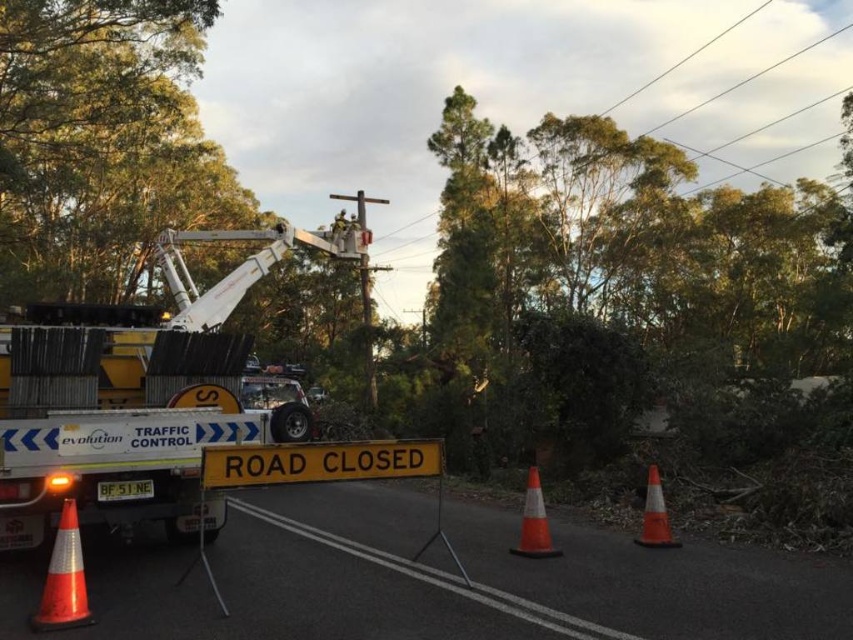
You are a pedestrian approaching the road closure area. You see the orange reflective cone at lower left and the orange reflective cone at center. Which cone is closer to you as you approach?

The orange reflective cone at lower left is closer to you because it is positioned in front of the orange reflective cone at center.

You are a delivery driver who needs to navigate around the white metallic tow truck at center and the orange reflective cone at lower left. The road is narrow here. Can your 3.5 meter long delivery van safely pass between them without hitting either?

The white metallic tow truck at center is 4.16 meters away from the orange reflective cone at lower left. Since your delivery van is 3.5 meters long, which is shorter than the distance between them, it should be able to safely pass through the gap without hitting either object.

You are a pedestrian trying to cross the road and see the white metallic tow truck at center and the orange reflective cone at lower left. Which object is closer to you?

The white metallic tow truck at center is closer to you since it is further to the viewer than the orange reflective cone at lower left, meaning it appears nearer in the scene.